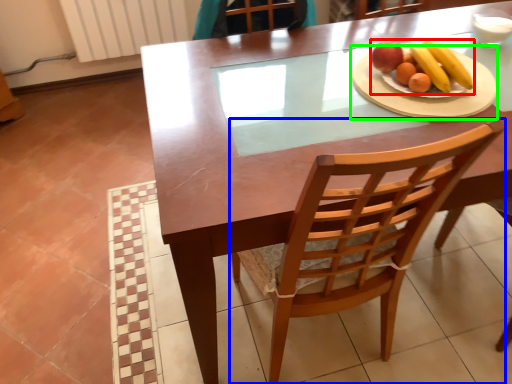
Question: Based on their relative distances, which object is nearer to fruit dish (highlighted by a red box)? Choose from chair (highlighted by a blue box) and platter (highlighted by a green box).

Choices:
 (A) chair
 (B) platter

Answer: (B)